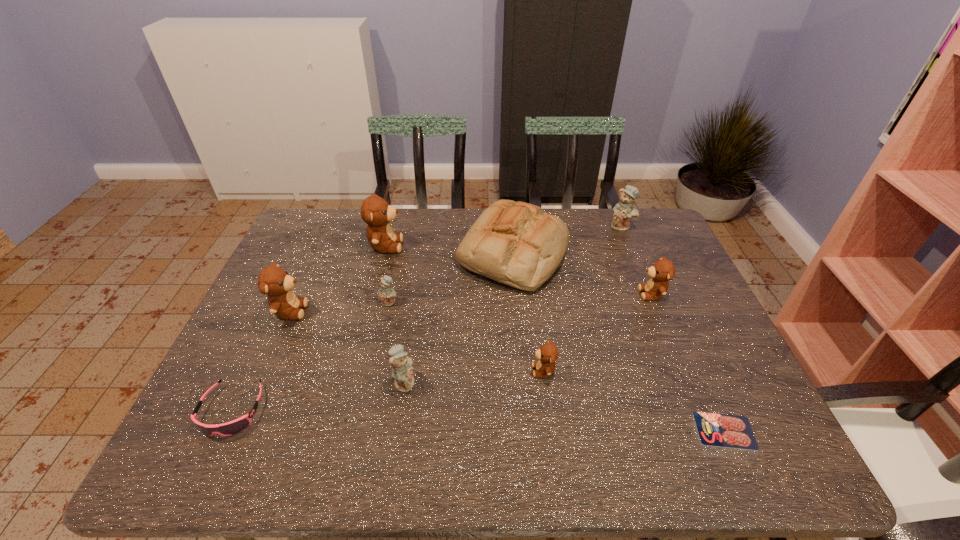
Image resolution: width=960 pixels, height=540 pixels. I want to click on the second farthest blue teddy bear, so click(x=386, y=295).

This screenshot has width=960, height=540. Identify the location of the leftmost blue teddy bear. (386, 295).

Locate an element on the screen. The width and height of the screenshot is (960, 540). the third teddy bear from right to left is located at coordinates (548, 353).

What are the coordinates of `the nearest brown teddy bear` in the screenshot? It's located at (548, 353).

Identify the location of the second shortest object. (237, 425).

Where is `pink goggles`? The image size is (960, 540). pink goggles is located at coordinates (237, 425).

I want to click on salami, so click(721, 430).

Where is `vacant space located 0.210m on the face of the farthest brown teddy bear`? This screenshot has height=540, width=960. vacant space located 0.210m on the face of the farthest brown teddy bear is located at coordinates (468, 246).

Locate an element on the screen. free point located on the front of the bread is located at coordinates (526, 399).

Image resolution: width=960 pixels, height=540 pixels. I want to click on free space located on the front-facing side of the farthest blue teddy bear, so click(x=660, y=320).